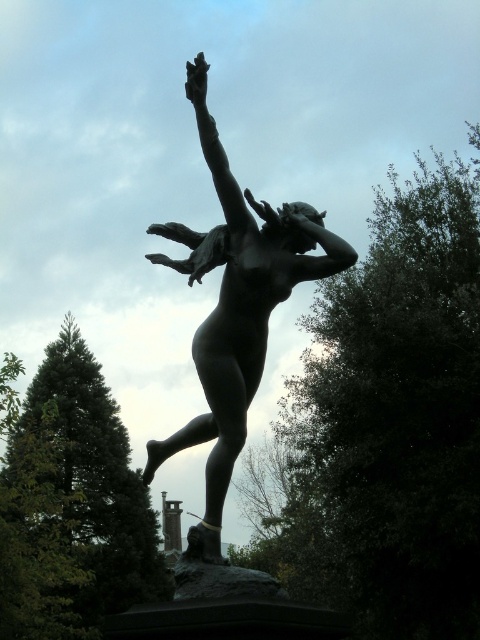
Question: Estimate the real-world distances between objects in this image. Which object is farther from the matte bronze arm at center?

Choices:
 (A) bronze arm at upper center
 (B) bronze statue at center

Answer: (A)

Question: Among these objects, which one is nearest to the camera?

Choices:
 (A) matte bronze arm at center
 (B) bronze statue at center

Answer: (B)

Question: Does bronze statue at center have a smaller size compared to matte bronze arm at center?

Choices:
 (A) no
 (B) yes

Answer: (A)

Question: Which point appears closest to the camera in this image?

Choices:
 (A) (204, 104)
 (B) (227, 164)

Answer: (A)

Question: Where is bronze statue at center located in relation to matte bronze arm at center in the image?

Choices:
 (A) right
 (B) left

Answer: (B)

Question: Observing the image, what is the correct spatial positioning of bronze statue at center in reference to matte bronze arm at center?

Choices:
 (A) right
 (B) left

Answer: (B)